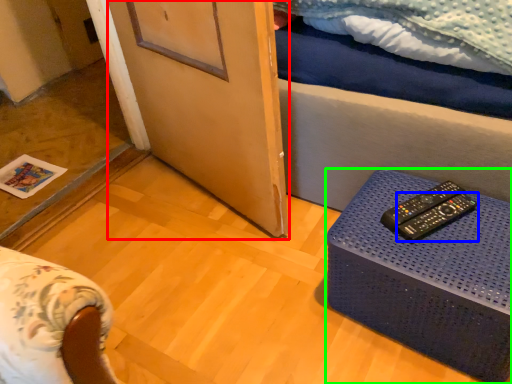
Question: Based on their relative distances, which object is nearer to screen door (highlighted by a red box)? Choose from remote control (highlighted by a blue box) and table (highlighted by a green box).

Choices:
 (A) remote control
 (B) table

Answer: (B)